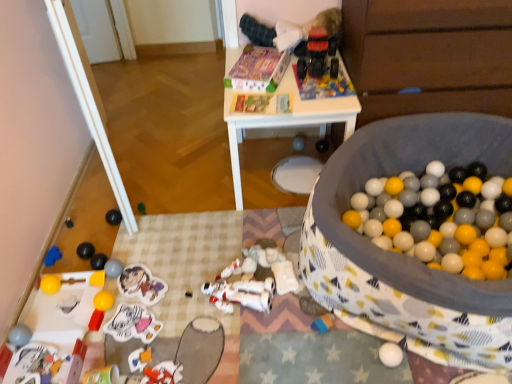
This screenshot has width=512, height=384. What are the coordinates of `free space to the back side of matte cardboard stickers at lower center, which appears as the ninth toy when viewed from the right` in the screenshot? It's located at (150, 252).